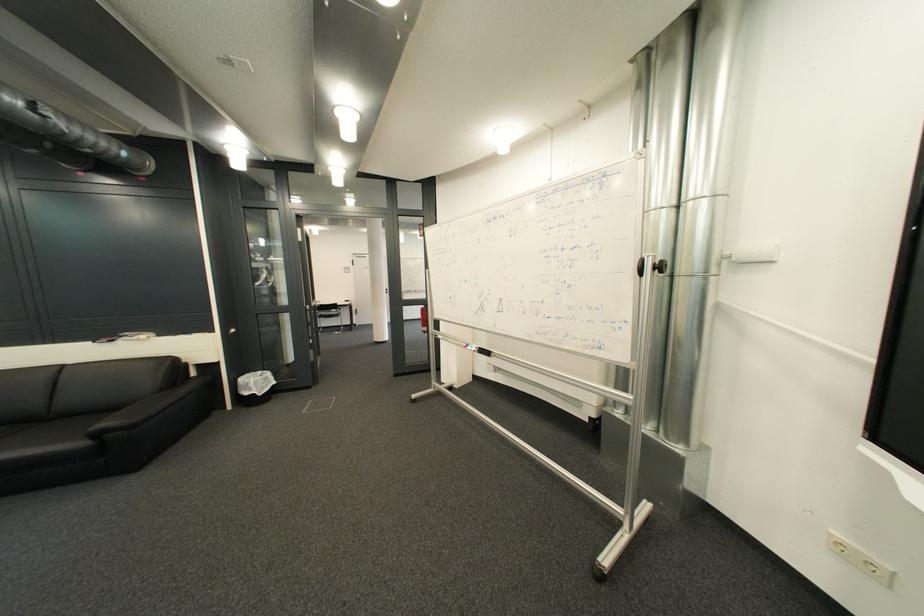
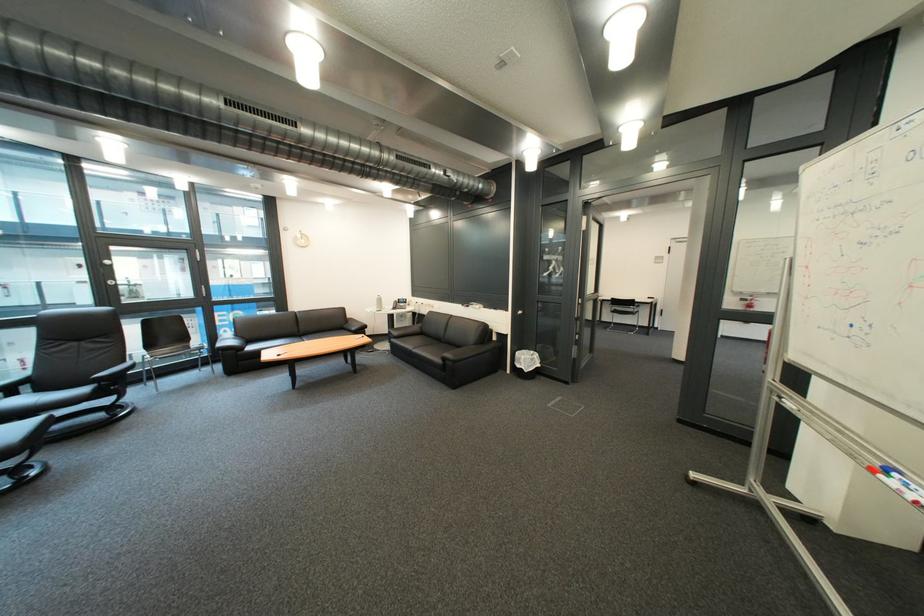
The point at [225,333] is marked in the first image. Where is the corresponding point in the second image?

(520, 312)